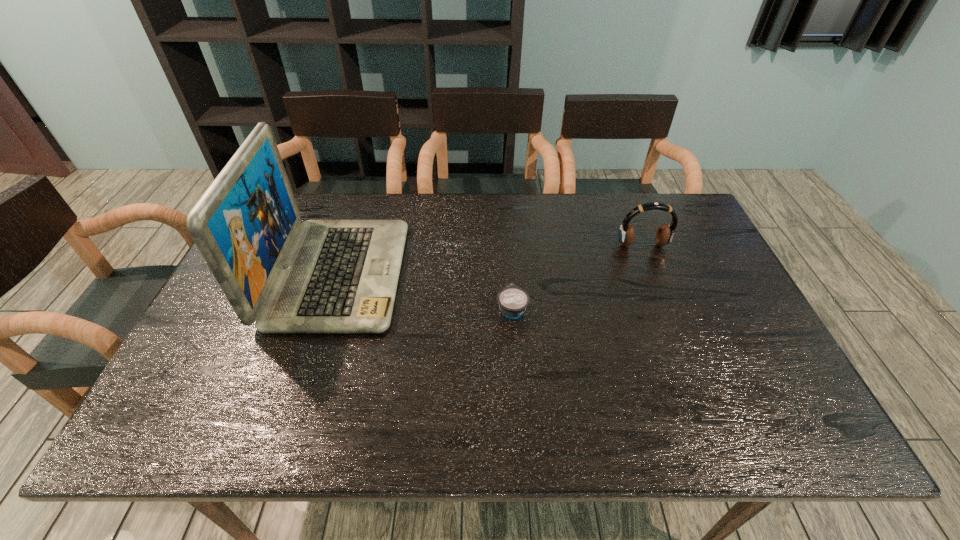
Where is `object that is at the left edge`? The height and width of the screenshot is (540, 960). object that is at the left edge is located at coordinates (339, 276).

What are the coordinates of `object located at the right edge` in the screenshot? It's located at (664, 235).

Locate an element on the screen. Image resolution: width=960 pixels, height=540 pixels. object located at the far left corner is located at coordinates (339, 276).

This screenshot has width=960, height=540. Find the location of `vacant space at the far edge of the desktop`. vacant space at the far edge of the desktop is located at coordinates (571, 207).

This screenshot has height=540, width=960. I want to click on free location at the near edge of the desktop, so (x=650, y=413).

The width and height of the screenshot is (960, 540). Find the location of `free space at the left edge of the desktop`. free space at the left edge of the desktop is located at coordinates (218, 383).

Locate an element on the screen. vacant space at the right edge of the desktop is located at coordinates (738, 358).

I want to click on vacant region at the near left corner, so tap(195, 419).

At what (x,y) coordinates should I click in order to perform the action: click on vacant area at the far right corner of the desktop. Please return your answer as a coordinate pair (x, y). The image size is (960, 540). Looking at the image, I should click on (687, 234).

Where is `blank region between the laptop computer and the second object from left to right`? blank region between the laptop computer and the second object from left to right is located at coordinates (425, 291).